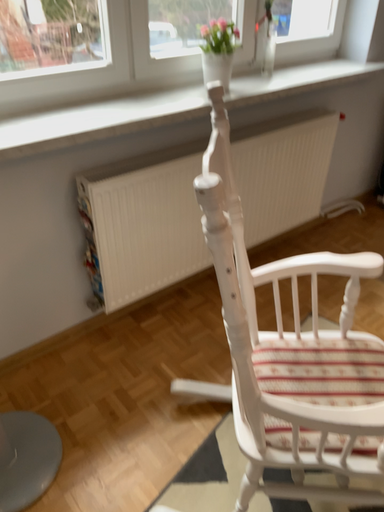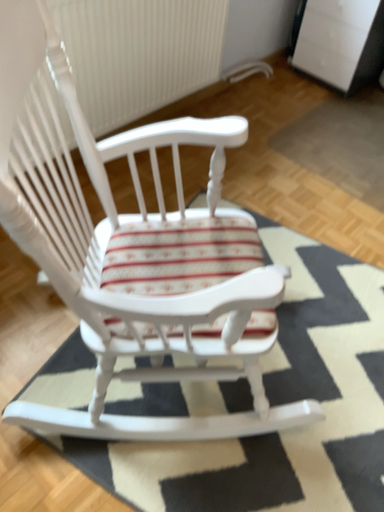
Question: How did the camera likely rotate when shooting the video?

Choices:
 (A) rotated upward
 (B) rotated downward

Answer: (B)